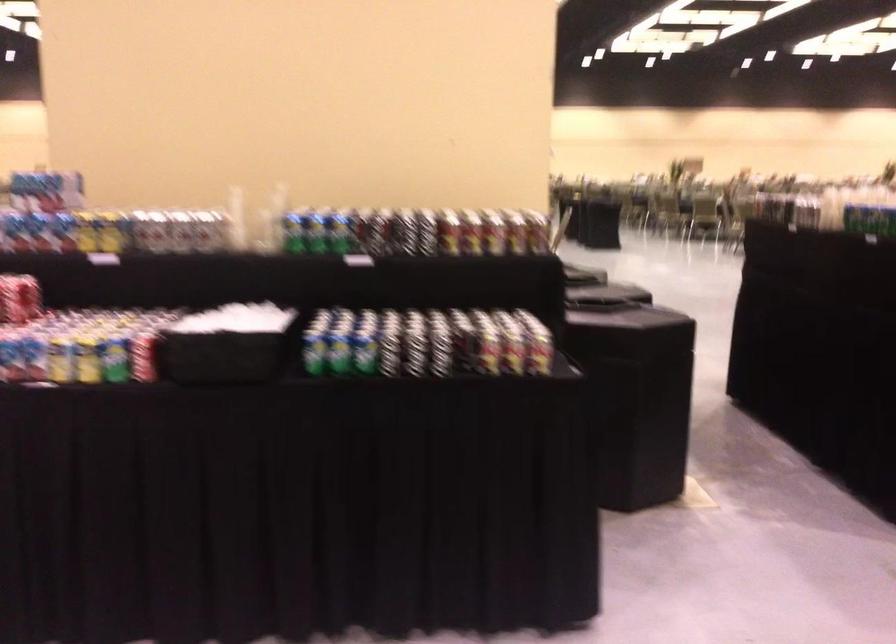
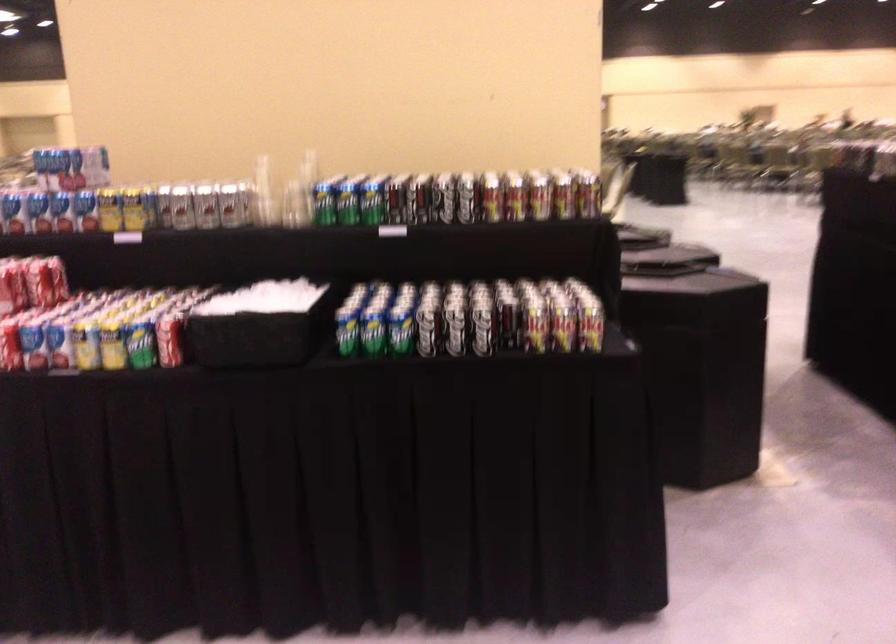
Where in the second image is the point corresponding to (179,232) from the first image?

(205, 205)